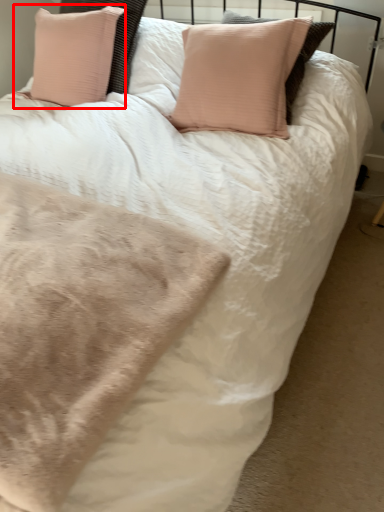
Question: From the image's perspective, where is pillow (annotated by the red box) located relative to blanket?

Choices:
 (A) above
 (B) below

Answer: (A)